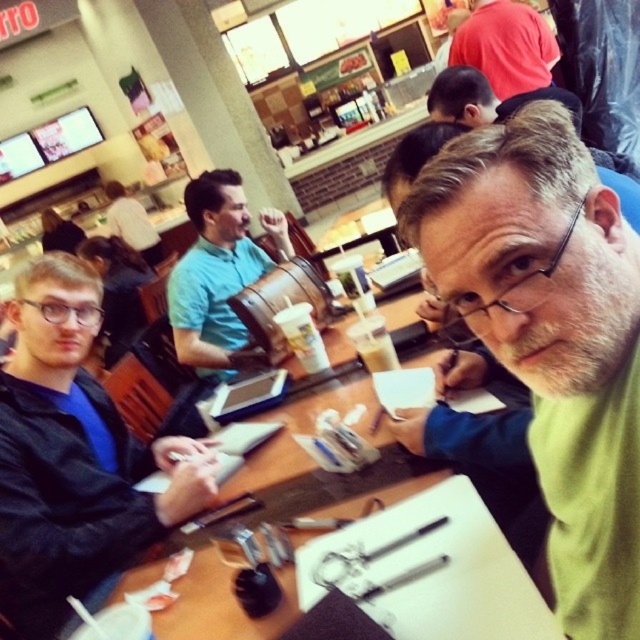
You are standing in the dining area and want to hand a menu to both the person wearing the green matte shirt at center and the person wearing the black matte jacket at left. Which one should you approach first based on their positions?

You should approach the green matte shirt at center first because it is closer to you than the black matte jacket at left, so you can reach them more easily.

You are a photographer standing in the dining area and want to take a picture of the teal matte shirt at center and the smooth brown leather jacket at upper center. Which object should you focus on first if you want to capture both in the same frame?

The teal matte shirt at center is below the smooth brown leather jacket at upper center, so you should focus on the smooth brown leather jacket at upper center first to ensure both are in the frame.

You are a delivery robot that is 0.8 meters wide. You need to move between the teal matte shirt at center and the smooth brown leather jacket at upper center. Can you fit through the space between them?

The teal matte shirt at center and smooth brown leather jacket at upper center are 1.13 meters apart from each other. Since the robot is 0.8 meters wide, it can fit through the space between them as the distance is greater than the robot width.